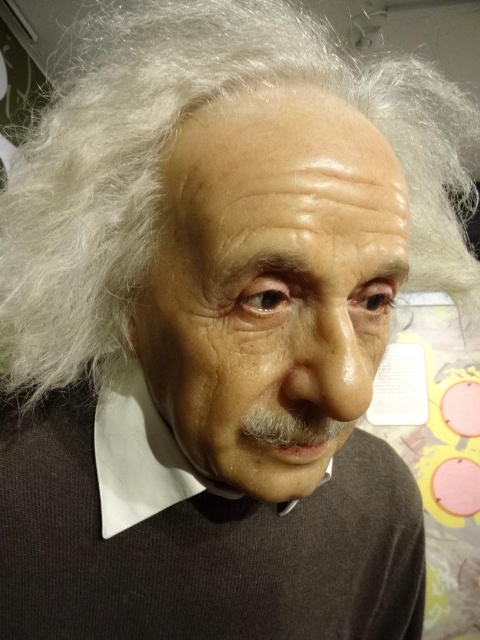
You are an art student observing the wax figure of Albert Einstein. You notice the white matte hair at center and the white matte shirt at center. Which object is positioned higher on the figure?

The white matte hair at center is above the white matte shirt at center, so the white matte hair at center is positioned higher on the figure.

You are a museum security guard checking the positioning of the wax figure of Albert Einstein. The wax figure has a point labeled as point (x=269, y=285). Where is this point located on the wax figure?

The point (x=269, y=285) is located on the smooth skin face at center of the wax figure.